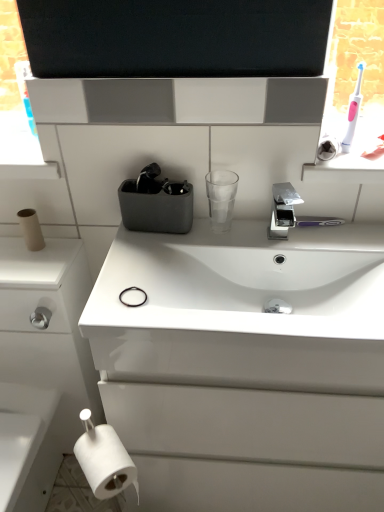
Question: Visually, is chrome metallic faucet at center positioned to the left or to the right of white matte toilet paper at lower left, which is the second toilet paper from top to bottom?

Choices:
 (A) left
 (B) right

Answer: (B)

Question: Considering the positions of chrome metallic faucet at center and white matte toilet paper at lower left, placed as the second toilet paper when sorted from left to right, in the image, is chrome metallic faucet at center taller or shorter than white matte toilet paper at lower left, placed as the second toilet paper when sorted from left to right,?

Choices:
 (A) tall
 (B) short

Answer: (B)

Question: Which object is the farthest from the transparent plastic cup at center?

Choices:
 (A) pink plastic toothbrush at upper right
 (B) white cardboard toilet paper at left, marked as the first toilet paper in a top-to-bottom arrangement
 (C) white glossy cabinet at lower left
 (D) white matte toilet paper at lower left, marked as the first toilet paper in a right-to-left arrangement
 (E) chrome metallic faucet at center

Answer: (C)

Question: Which of these objects is positioned farthest from the white matte toilet paper at lower left, marked as the first toilet paper in a right-to-left arrangement?

Choices:
 (A) pink plastic toothbrush at upper right
 (B) white cardboard toilet paper at left, placed as the 2th toilet paper when sorted from front to back
 (C) chrome metallic faucet at center
 (D) white glossy cabinet at lower left
 (E) transparent plastic cup at center

Answer: (A)